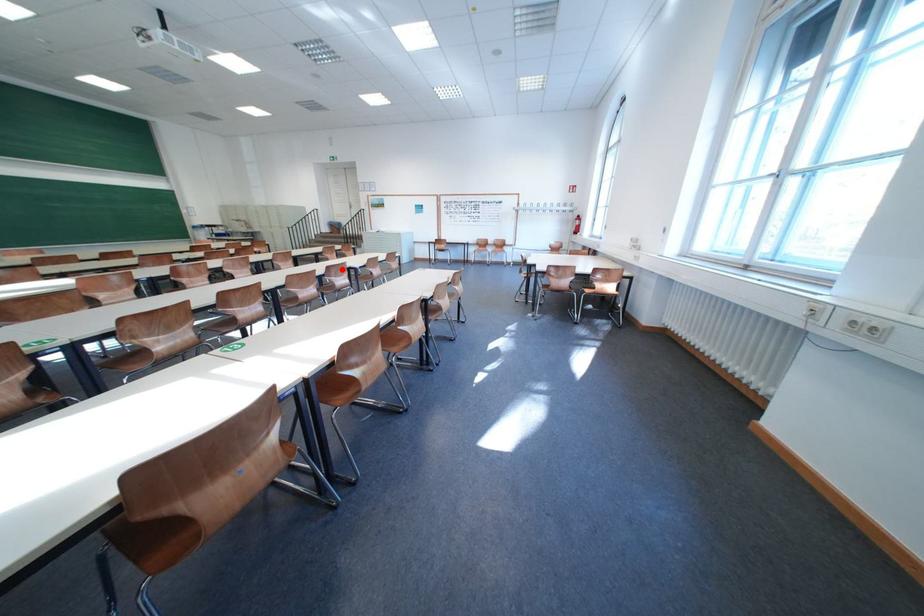
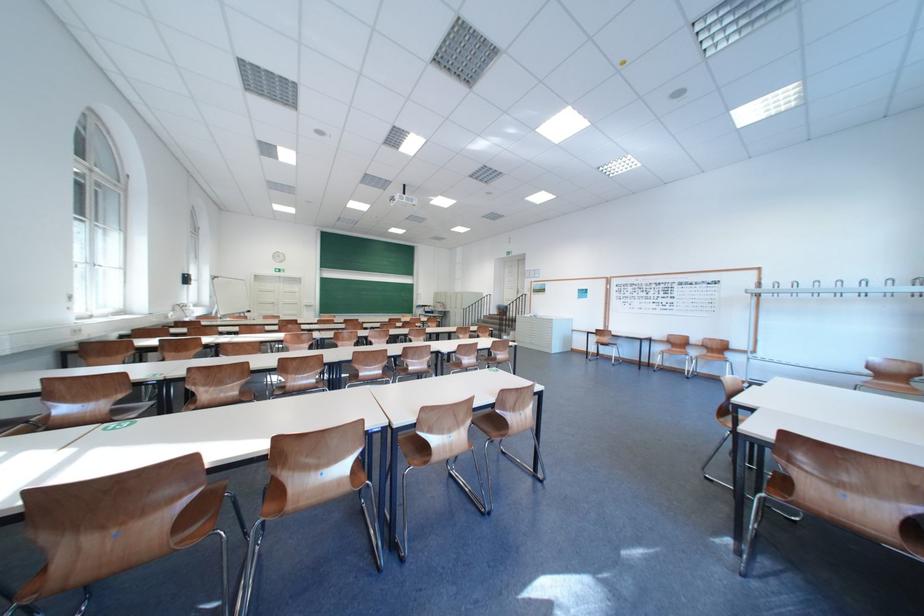
Question: I am providing you with two images of the same scene from different viewpoints. A red point is shown in image1. For the corresponding object point in image2, is it positioned nearer or farther from the camera?

Choices:
 (A) Nearer
 (B) Farther

Answer: (B)